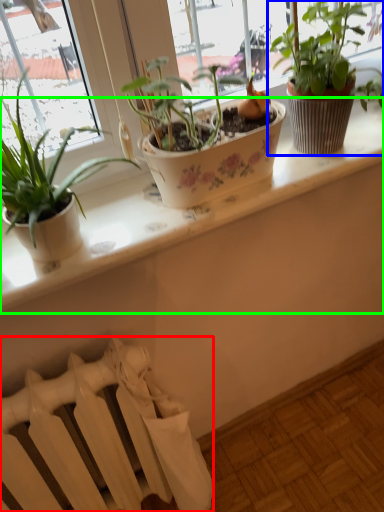
Question: Based on their relative distances, which object is nearer to radiator (highlighted by a red box)? Choose from houseplant (highlighted by a blue box) and window sill (highlighted by a green box).

Choices:
 (A) houseplant
 (B) window sill

Answer: (B)